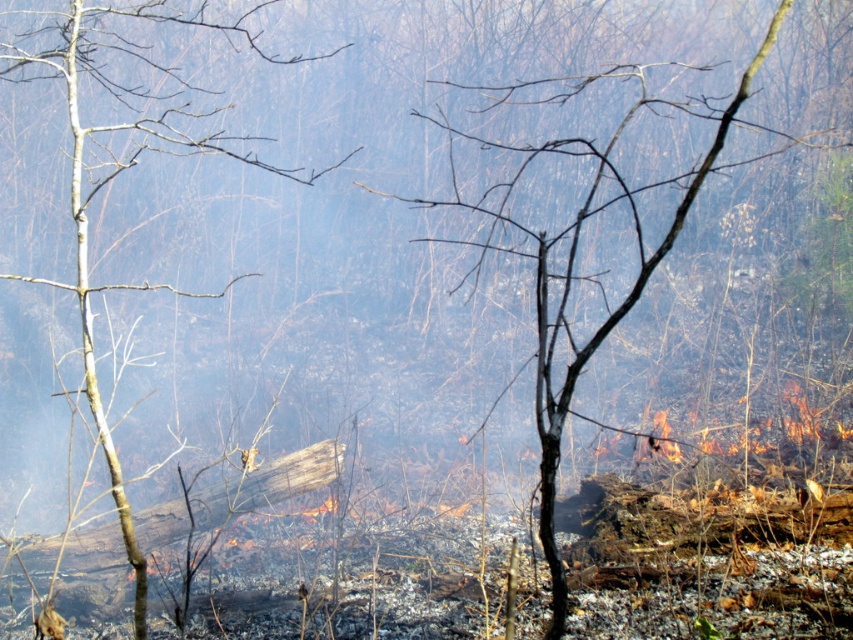
Question: Which of the following is the closest to the observer?

Choices:
 (A) (175, 20)
 (B) (685, 189)

Answer: (B)

Question: Which of the following is the farthest from the observer?

Choices:
 (A) (579, 138)
 (B) (82, 200)

Answer: (B)

Question: Which of the following is the closest to the observer?

Choices:
 (A) coord(543,332)
 (B) coord(242,276)

Answer: (A)

Question: Is the position of brown bark tree at left more distant than that of brown bark tree at center?

Choices:
 (A) no
 (B) yes

Answer: (B)

Question: Is brown bark tree at left smaller than brown bark tree at center?

Choices:
 (A) yes
 (B) no

Answer: (B)

Question: Does brown bark tree at left have a larger size compared to brown bark tree at center?

Choices:
 (A) yes
 (B) no

Answer: (A)